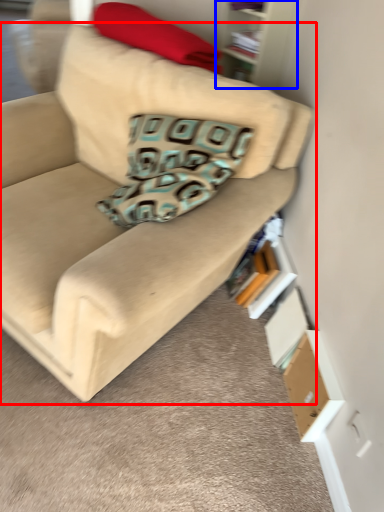
Question: Which of the following is the closest to the observer, studio couch (highlighted by a red box) or bookshelf (highlighted by a blue box)?

Choices:
 (A) studio couch
 (B) bookshelf

Answer: (A)